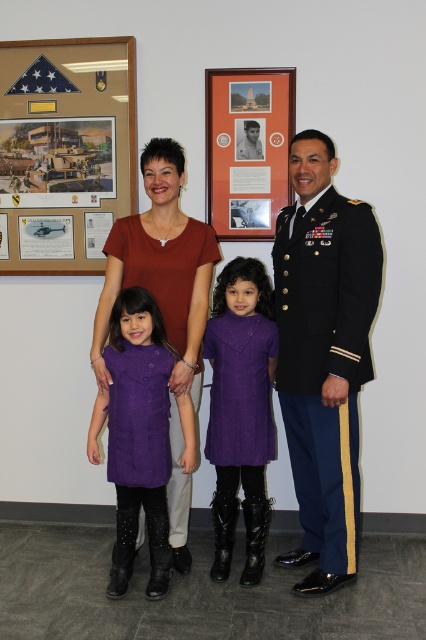
What are the coordinates of the matte wooden picture frame at center?

The coordinates of the matte wooden picture frame at center are at point (247, 148).

From the picture: You are a guest at a formal event and notice two items in the room. The first is a matte wooden picture frame at center and the second is a shiny black uniform at right. Which item is closer to the left side of the room?

The matte wooden picture frame at center is closer to the left side of the room because it is positioned to the left of the shiny black uniform at right.